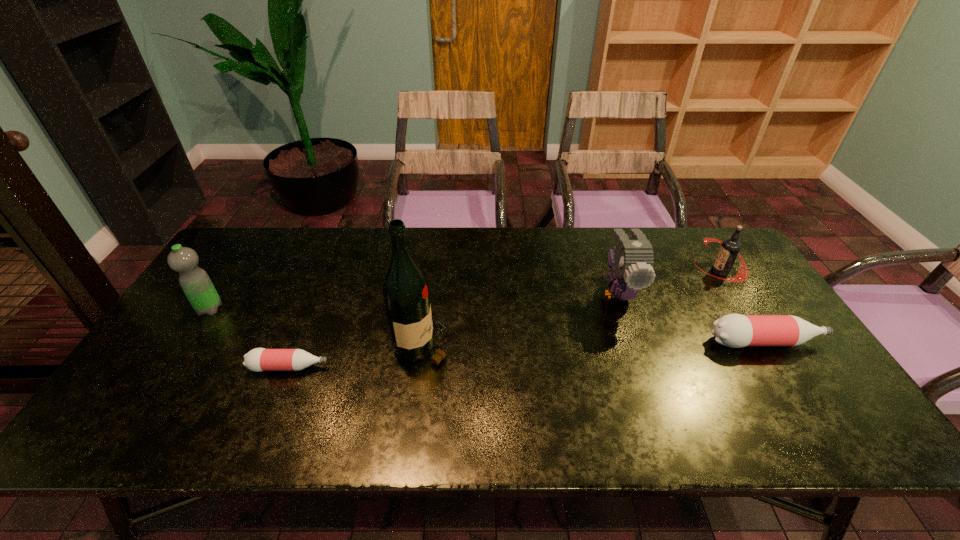
In order to click on vacant position located 0.090m at the beak of the third object from right to left in this screenshot , I will do `click(636, 345)`.

Find the location of a particular element. free spot located 0.140m on the label of the third shortest object is located at coordinates (652, 271).

At what (x,y) coordinates should I click in order to perform the action: click on vacant space located on the label of the third shortest object. Please return your answer as a coordinate pair (x, y). This screenshot has height=540, width=960. Looking at the image, I should click on (681, 271).

At what (x,y) coordinates should I click in order to perform the action: click on vacant space located on the label of the third shortest object. Please return your answer as a coordinate pair (x, y). This screenshot has width=960, height=540. Looking at the image, I should click on click(x=661, y=271).

Locate an element on the screen. free spot located 0.280m on the right of the water bottle is located at coordinates (320, 309).

What are the coordinates of `free space located on the surface of the tallest object` in the screenshot? It's located at (501, 346).

The height and width of the screenshot is (540, 960). What are the coordinates of `bird that is at the far edge` in the screenshot? It's located at (632, 260).

You are a GUI agent. You are given a task and a screenshot of the screen. Output one action in this format:
    pyautogui.click(x=<x>, y=<y>)
    Task: Click on the root beer that is at the far edge
    This screenshot has height=540, width=960.
    Given the screenshot: What is the action you would take?
    pyautogui.click(x=730, y=247)

Locate an element on the screen. object that is at the near edge is located at coordinates (259, 359).

What are the coordinates of `object that is positioned at the left edge` in the screenshot? It's located at (196, 284).